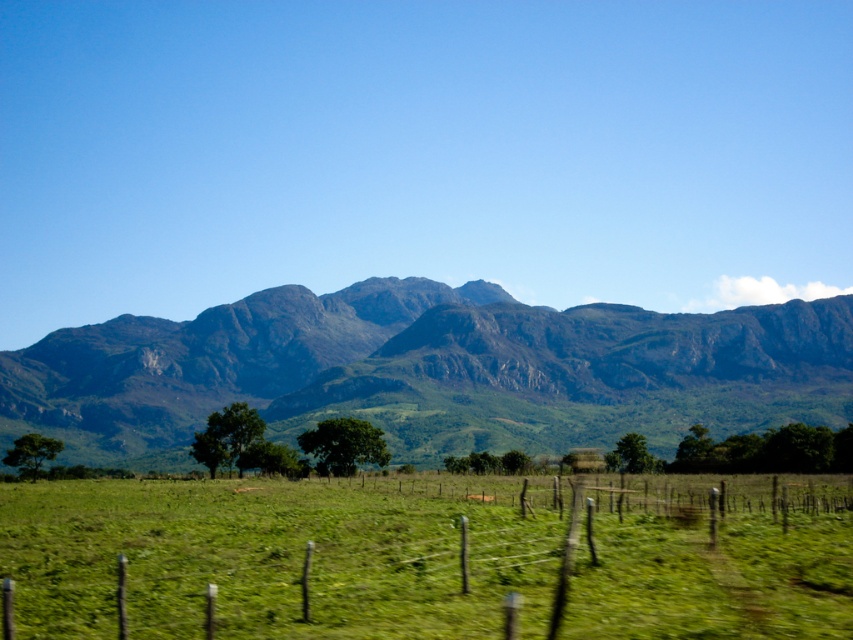
You are standing in the rural landscape and want to place a small flag at each of the two points marked in the image. Which point, point (90,582) or point (177,360), is closer to you so you can reach it first without moving?

Point (90,582) is closer to the viewer than point (177,360), so you can reach it first without moving.

You are a hiker standing on the green grassy field at center and want to reach the green textured mountain range at center. Which direction should you go to move towards the mountain range?

The green textured mountain range at center is taller than the green grassy field at center, so you should go forward towards the direction of the green textured mountain range at center.

You are standing in the middle of the green grassy field at center and want to walk towards the green textured mountain range at center. Which direction should you head to get closer to the mountain range?

You should head towards the green textured mountain range at center because it is farther away from you than the green grassy field at center where you are currently standing.